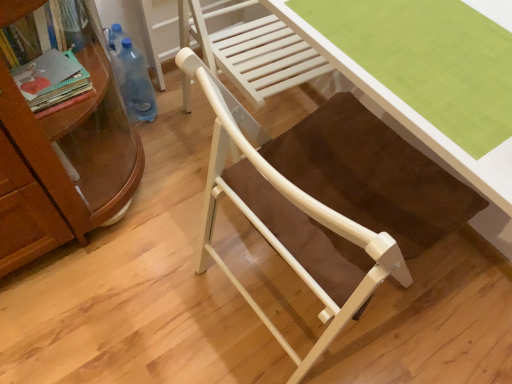
This screenshot has height=384, width=512. Find the location of `empty space that is to the right of matte white chair at center`. empty space that is to the right of matte white chair at center is located at coordinates (445, 314).